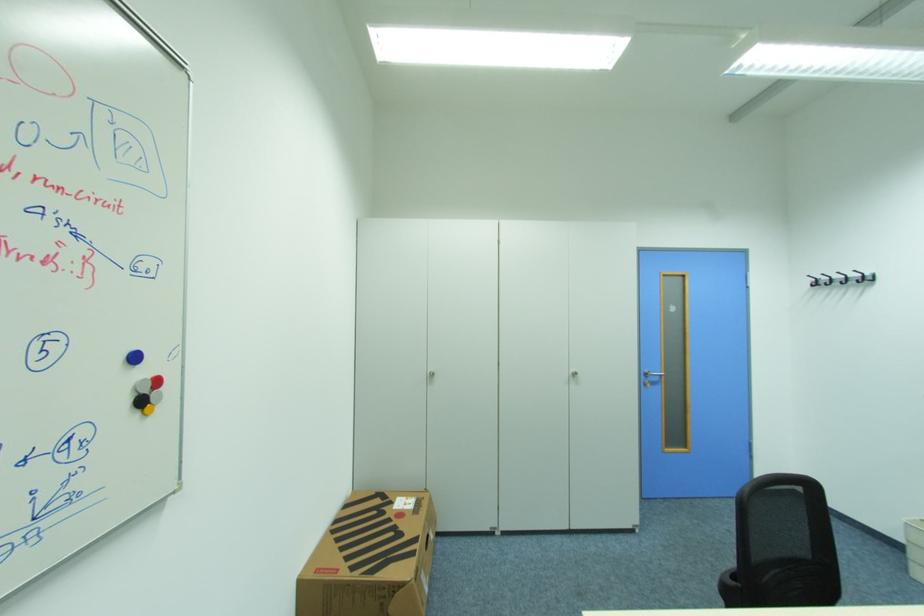
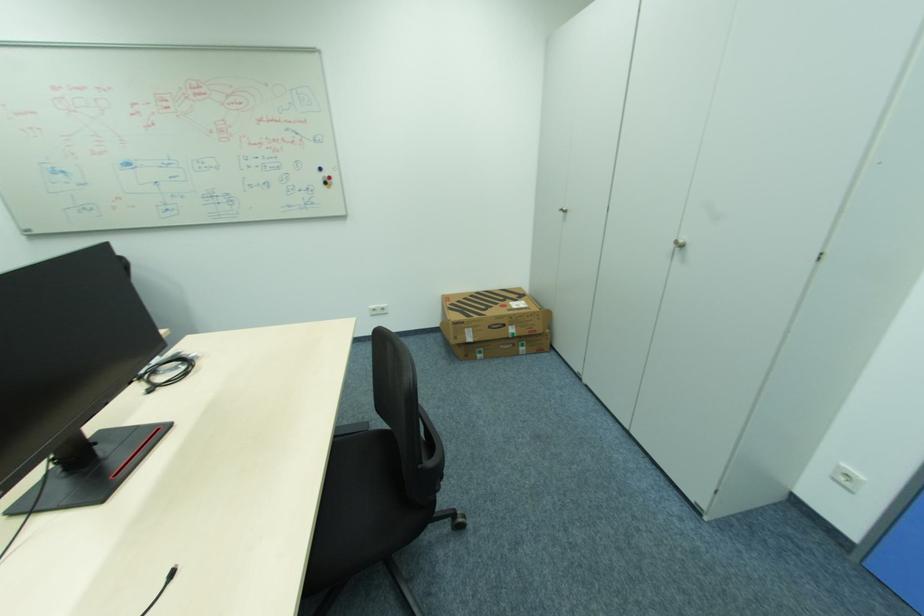
Find the pixel in the second image that matches [390,508] in the first image.

(513, 300)